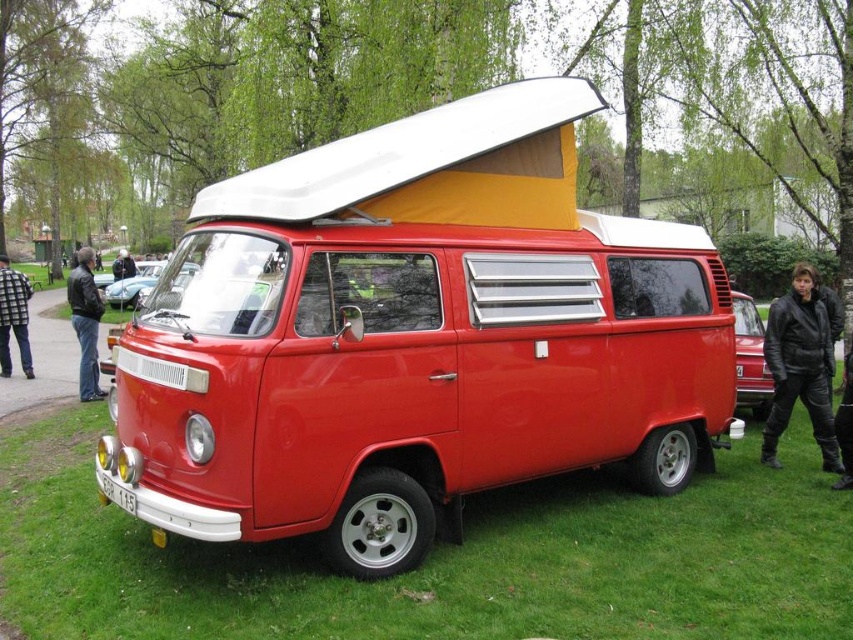
Question: Which point is closer to the camera taking this photo?

Choices:
 (A) (76, 321)
 (B) (471, 184)

Answer: (B)

Question: Does black leather jacket at lower right appear on the left side of leather jacket at left?

Choices:
 (A) yes
 (B) no

Answer: (B)

Question: Which object is closer to the camera taking this photo?

Choices:
 (A) shiny chrome mirror at center
 (B) matte red van at center
 (C) leather jacket at left
 (D) brushed metal jacket at lower left

Answer: (B)

Question: Does leather jacket at left appear under brushed metal jacket at lower left?

Choices:
 (A) no
 (B) yes

Answer: (A)

Question: Which is nearer to the brushed metal jacket at lower left?

Choices:
 (A) black leather jacket at lower right
 (B) leather jacket at left

Answer: (B)

Question: Can you confirm if black leather jacket at lower right is thinner than shiny chrome mirror at center?

Choices:
 (A) yes
 (B) no

Answer: (B)